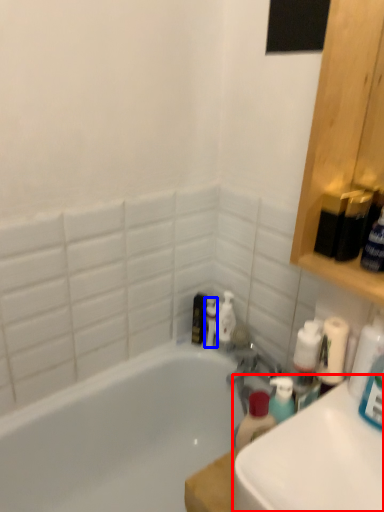
Question: Which object appears farthest to the camera in this image, counter top (highlighted by a red box) or toiletry (highlighted by a blue box)?

Choices:
 (A) counter top
 (B) toiletry

Answer: (B)